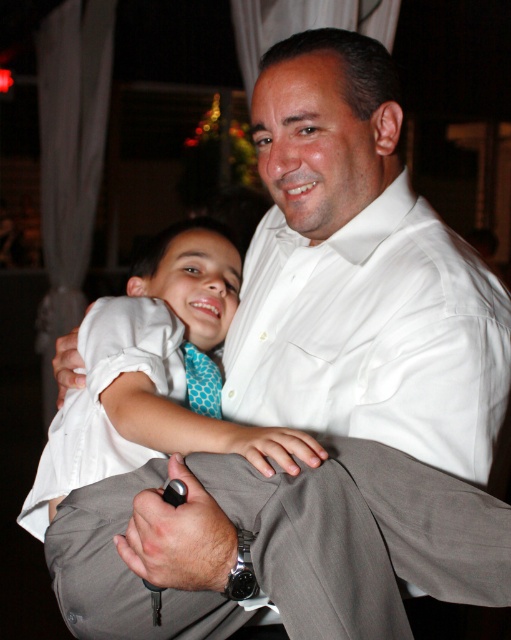
The image size is (511, 640). Describe the element at coordinates (100, 401) in the screenshot. I see `white cotton dress at center` at that location.

Can you confirm if white cotton dress at center is wider than blue dotted tie at center?

Indeed, white cotton dress at center has a greater width compared to blue dotted tie at center.

This screenshot has height=640, width=511. What are the coordinates of `white cotton dress at center` in the screenshot? It's located at (100, 401).

Who is higher up, white smooth dress shirt at center or blue dotted tie at center?

white smooth dress shirt at center

Can you confirm if white smooth dress shirt at center is smaller than blue dotted tie at center?

No, white smooth dress shirt at center is not smaller than blue dotted tie at center.

At what (x,y) coordinates should I click in order to perform the action: click on white smooth dress shirt at center. Please return your answer as a coordinate pair (x, y). This screenshot has height=640, width=511. Looking at the image, I should click on (374, 333).

This screenshot has width=511, height=640. In order to click on white smooth dress shirt at center in this screenshot , I will do `click(374, 333)`.

Is white cotton shirt at center further to the viewer compared to blue dotted tie at center?

No, white cotton shirt at center is closer to the viewer.

Who is shorter, white cotton shirt at center or blue dotted tie at center?

With less height is blue dotted tie at center.

Is point (89, 465) less distant than point (210, 392)?

That is True.

The width and height of the screenshot is (511, 640). Find the location of `white cotton shirt at center`. white cotton shirt at center is located at coordinates (153, 376).